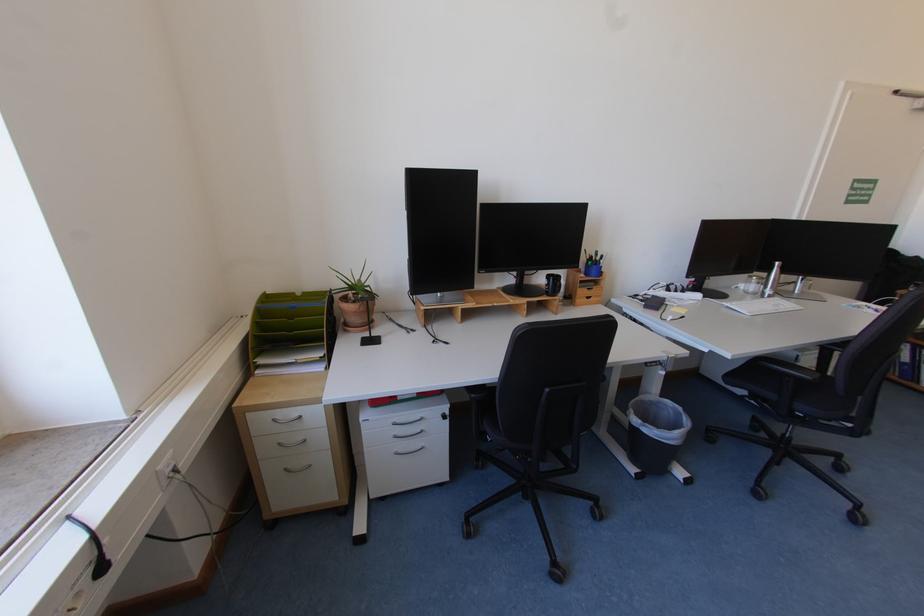
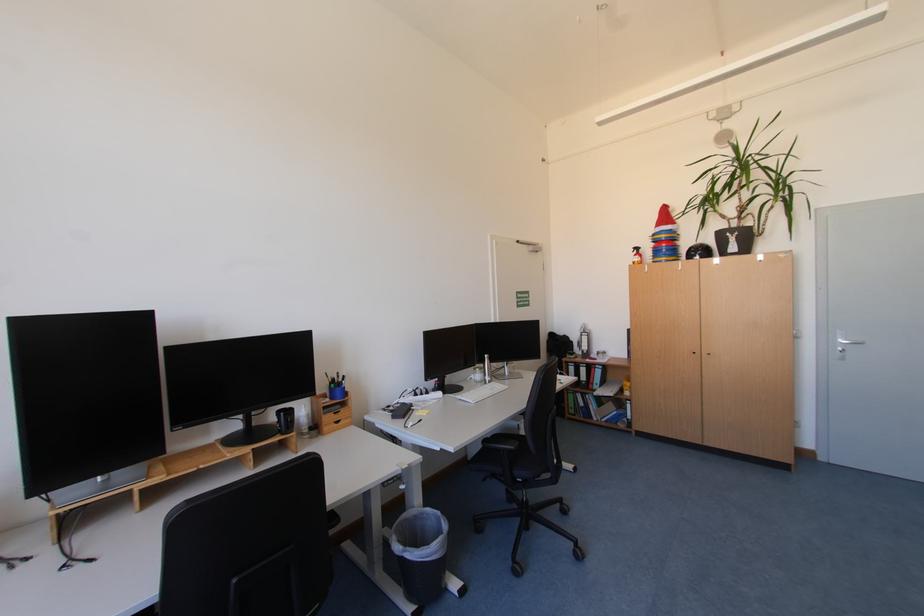
The point at (x=647, y=430) is marked in the first image. Where is the corresponding point in the second image?

(409, 557)